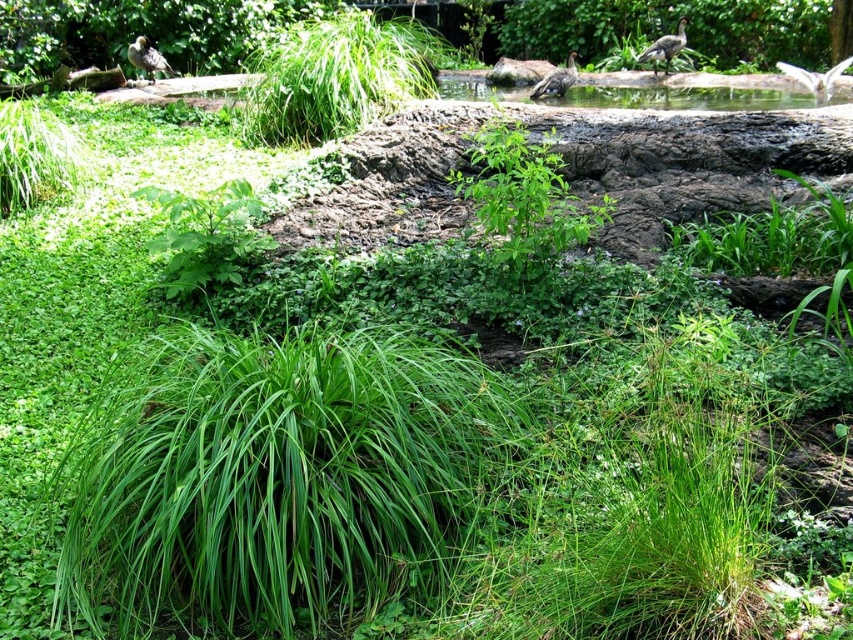
You are a birdwatcher observing two brown feathered birds in the sky. You see the brown feathered bird at upper left and the brown feathered bird at upper center. Which bird is positioned more to the left?

The brown feathered bird at upper left is positioned more to the left than the brown feathered bird at upper center.

In the scene shown: You are standing in the garden and want to place a 30 feet long ladder behind the brown fuzzy rock at center so that it doesn t obstruct the view of the rock. Is the distance sufficient for this placement?

The brown fuzzy rock at center is 27.71 feet away from the viewer. Placing a 30 feet long ladder behind it would mean the ladder extends beyond the rock s position, potentially making part of it visible from the viewer s perspective. Therefore, the distance is insufficient to prevent the ladder from obstructing the view of the rock.